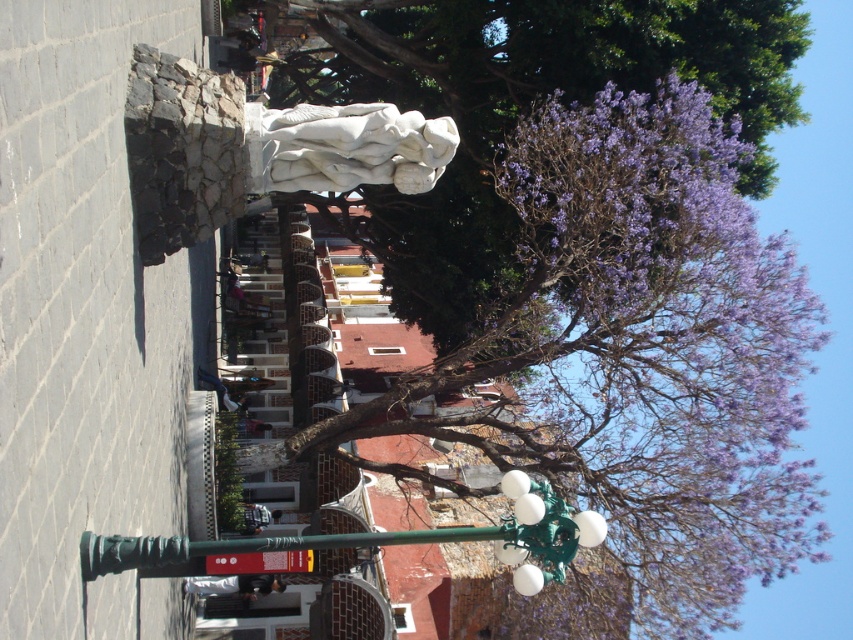
Question: Can you confirm if purple leafy tree at upper center is positioned to the right of green painted metal streetlight at lower center?

Choices:
 (A) no
 (B) yes

Answer: (B)

Question: Among these objects, which one is farthest from the camera?

Choices:
 (A) purple leafy tree at upper center
 (B) white marble statue at center
 (C) green painted metal streetlight at lower center

Answer: (A)

Question: Considering the real-world distances, which object is closest to the green painted metal streetlight at lower center?

Choices:
 (A) white marble statue at center
 (B) purple leafy tree at upper center

Answer: (A)

Question: Is purple leafy tree at upper center bigger than green painted metal streetlight at lower center?

Choices:
 (A) yes
 (B) no

Answer: (A)

Question: Which of the following is the farthest from the observer?

Choices:
 (A) (212, 540)
 (B) (325, 108)

Answer: (A)

Question: Where is purple leafy tree at upper center located in relation to white marble statue at center in the image?

Choices:
 (A) below
 (B) above

Answer: (B)